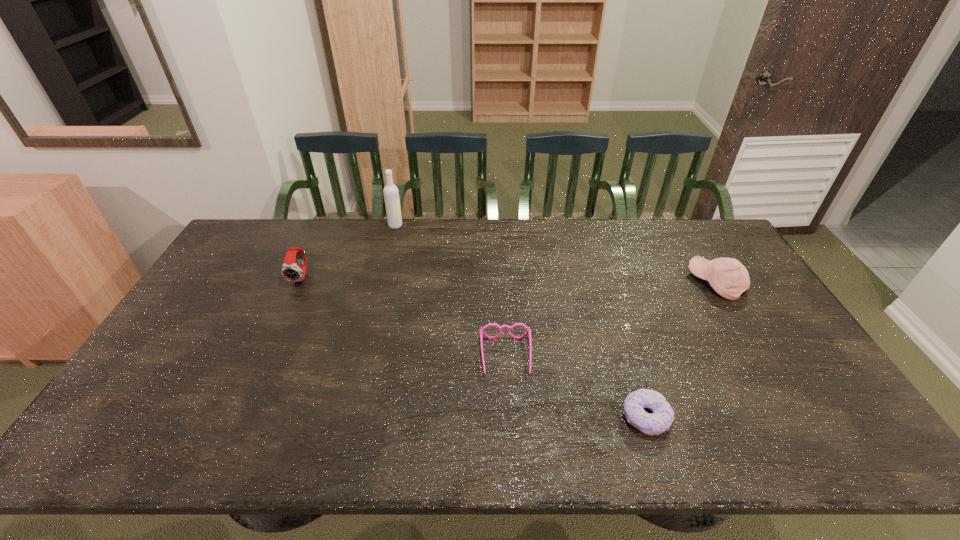
What are the coordinates of `empty space between the tallest object and the rightmost object` in the screenshot? It's located at (556, 254).

Where is `empty space that is in between the fourth farthest object and the watch`? empty space that is in between the fourth farthest object and the watch is located at coordinates (404, 316).

Identify which object is the fourth closest to the baseball cap. Please provide its 2D coordinates. Your answer should be formatted as a tuple, i.e. [(x, y)], where the tuple contains the x and y coordinates of a point satisfying the conditions above.

[(290, 271)]

Where is `object identified as the closest to the baseball cap`? object identified as the closest to the baseball cap is located at coordinates (663, 415).

The width and height of the screenshot is (960, 540). In order to click on free space that satisfies the following two spatial constraints: 1. on the arms of the nearest object; 2. on the left side of the third object from right to left in this screenshot , I will do `click(510, 417)`.

Identify the location of free space that satisfies the following two spatial constraints: 1. on the face of the watch; 2. on the right side of the doughnut. Image resolution: width=960 pixels, height=540 pixels. (236, 417).

Image resolution: width=960 pixels, height=540 pixels. I want to click on free space that satisfies the following two spatial constraints: 1. on the front-facing side of the rightmost object; 2. on the front side of the fourth object from left to right, so click(798, 417).

Where is `vacant space that satisfies the following two spatial constraints: 1. on the arms of the nearest object; 2. on the right side of the third object from left to right`? The width and height of the screenshot is (960, 540). vacant space that satisfies the following two spatial constraints: 1. on the arms of the nearest object; 2. on the right side of the third object from left to right is located at coordinates (510, 417).

Locate an element on the screen. This screenshot has height=540, width=960. free spot that satisfies the following two spatial constraints: 1. on the arms of the fourth farthest object; 2. on the left side of the doughnut is located at coordinates (510, 417).

Find the location of a particular element. Image resolution: width=960 pixels, height=540 pixels. vacant area in the image that satisfies the following two spatial constraints: 1. on the arms of the nearest object; 2. on the right side of the second nearest object is located at coordinates (510, 417).